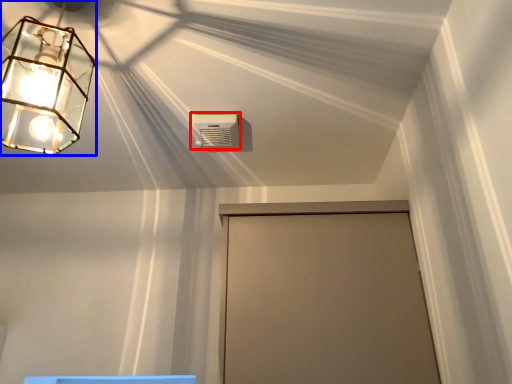
Question: Which object is further to the camera taking this photo, air conditioning (highlighted by a red box) or lamp (highlighted by a blue box)?

Choices:
 (A) air conditioning
 (B) lamp

Answer: (A)